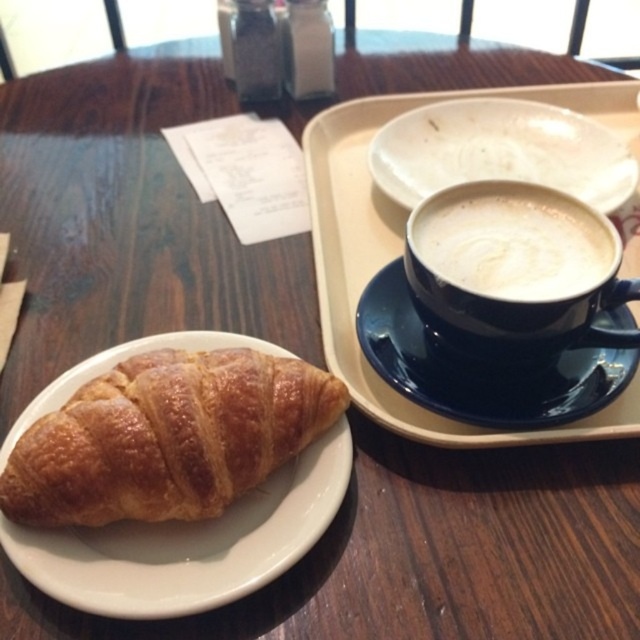
You are a chef arranging items on a table for a photo shoot. You need to place a golden brown flaky croissant at lower left and a white frothy coffee at upper right. According to the scene, where should you position the croissant relative to the coffee?

The golden brown flaky croissant at lower left should be placed below the white frothy coffee at upper right as per the scene description.

You are a barista trying to determine which item in the image is taller. You see the golden brown flaky croissant at lower left and the white frothy coffee at upper right. Which one is taller?

The golden brown flaky croissant at lower left is much taller than the white frothy coffee at upper right according to the description.

You are a delivery robot instructed to place a small package on the table. The package must be placed exactly at the point with coordinates point (403, 250). However, there is a beige tray with a dark blue cup and saucer on the right side of the table. Can you place the package at the specified coordinates without moving the existing items?

The point (403, 250) is on the white plastic tray at upper right. Since the beige tray with a dark blue cup and saucer is located at the right side of the table, placing the package at that point would require moving the existing items as the specified coordinates are occupied by the tray.